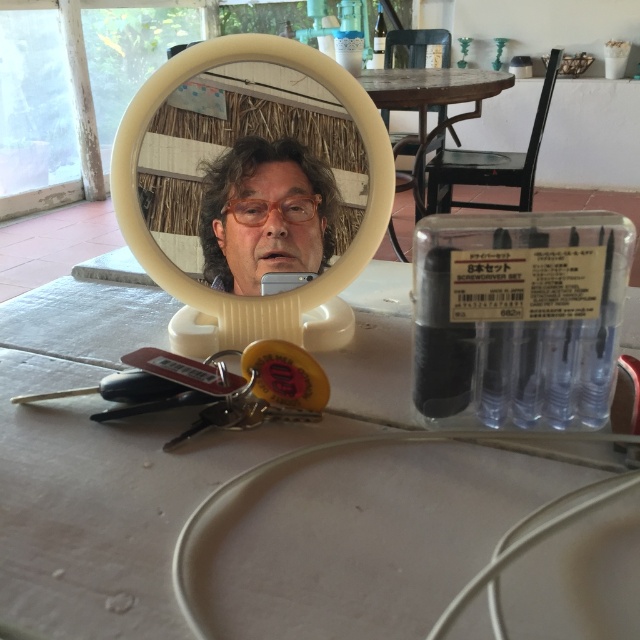
Question: Can you confirm if white matte table at center is positioned below white plastic mirror at center?

Choices:
 (A) no
 (B) yes

Answer: (B)

Question: Can you confirm if white matte table at center is bigger than white plastic mirror at center?

Choices:
 (A) yes
 (B) no

Answer: (A)

Question: Is white plastic mirror at center wider than matte plastic man at center?

Choices:
 (A) no
 (B) yes

Answer: (B)

Question: Which point is farther from the camera taking this photo?

Choices:
 (A) (67, 365)
 (B) (227, 300)
 (C) (220, 257)

Answer: (B)

Question: Which object is positioned farthest from the white plastic mirror at center?

Choices:
 (A) white matte table at center
 (B) matte plastic man at center

Answer: (A)

Question: Which of the following is the closest to the observer?

Choices:
 (A) (205, 237)
 (B) (369, 240)
 (C) (490, 636)

Answer: (C)